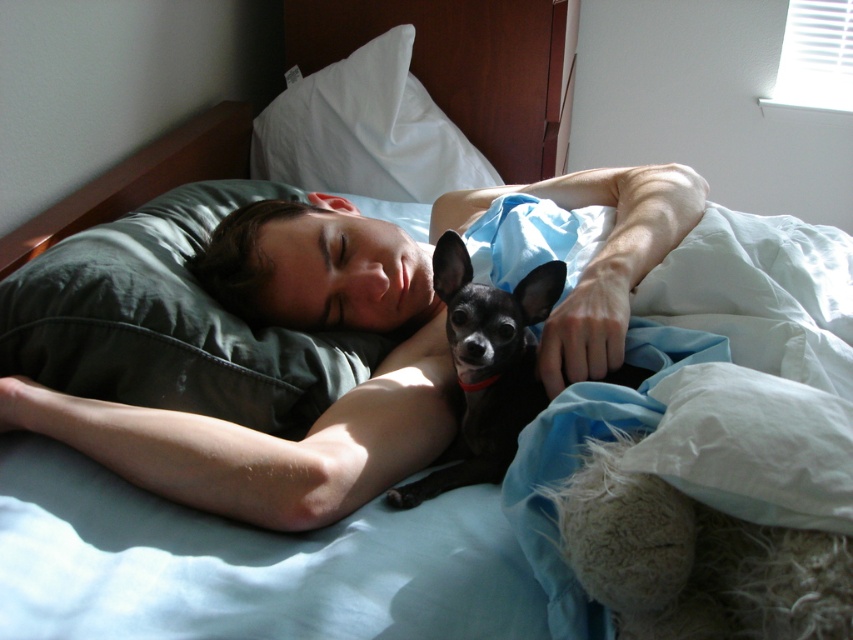
You are trying to place a small decorative item between the matte green pillow at upper left and the green fabric pillow at upper center on the bed. Based on their positions, which pillow should you place the item closer to in order to center it between them?

The matte green pillow at upper left is positioned to the right of the green fabric pillow at upper center. To center the item between them, place it closer to the green fabric pillow at upper center since the matte green pillow is already shifted to the right.

You are trying to place a new decorative item on the bed. The bed has a green fabric pillow at upper center and a black smooth dog at center. Which object is located higher up on the bed?

The green fabric pillow at upper center is positioned over the black smooth dog at center, so it is higher up.

You are standing at the origin point of the bed and want to place a new red blanket on the bed. The origin point is at the bottom left corner of the bed. The coordinates are given as a percentage of the bed length and width. Where should you place the new red blanket so that it is directly below the green fabric pillow at upper center located at point (170, 323)?

To place the new red blanket directly below the green fabric pillow at upper center located at point (170, 323), you should position it at the same x coordinate of 0.505 but lower y coordinate. Since the origin is at the bottom left, decreasing the y value moves downward. For example, placing it at 0.505, 0.300 would be directly below.